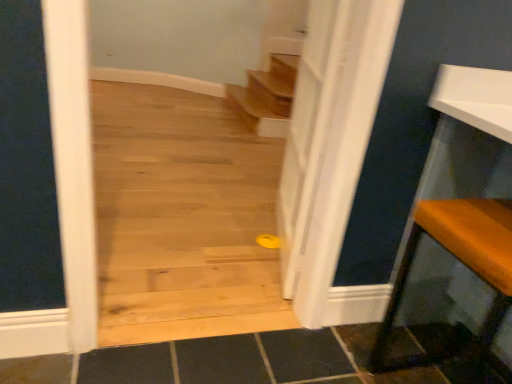
This screenshot has width=512, height=384. Find the location of `vacant region above orange fabric cushion at right (from a real-world perspective)`. vacant region above orange fabric cushion at right (from a real-world perspective) is located at coordinates (479, 219).